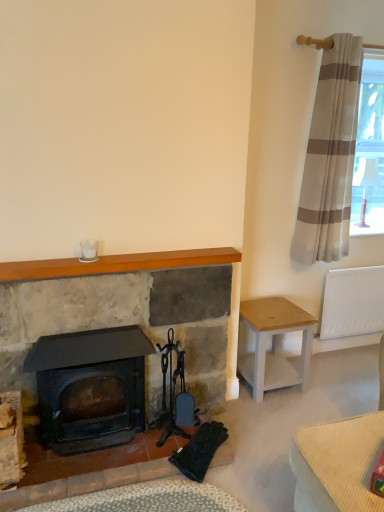
Image resolution: width=384 pixels, height=512 pixels. I want to click on free point above wooden mantle at upper center (from a real-world perspective), so click(121, 258).